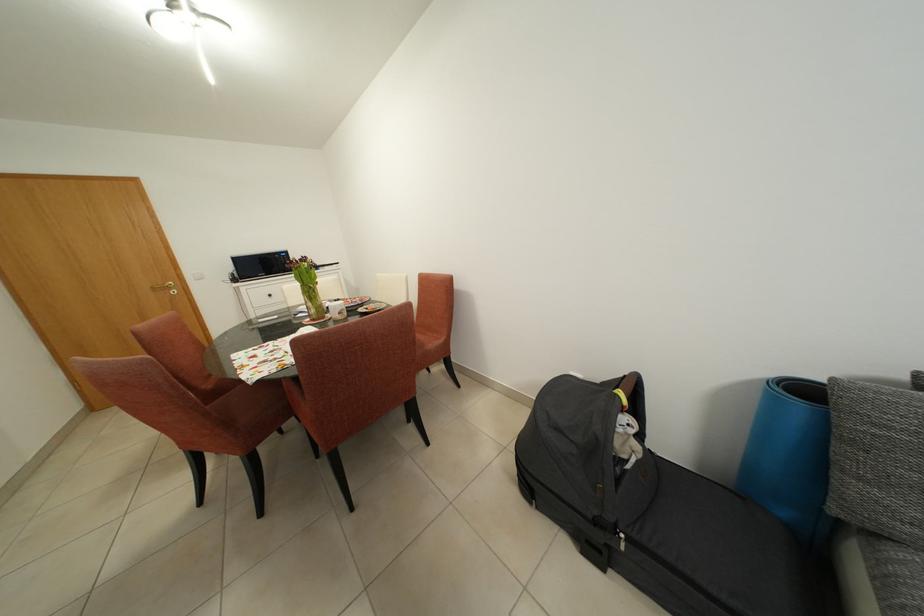
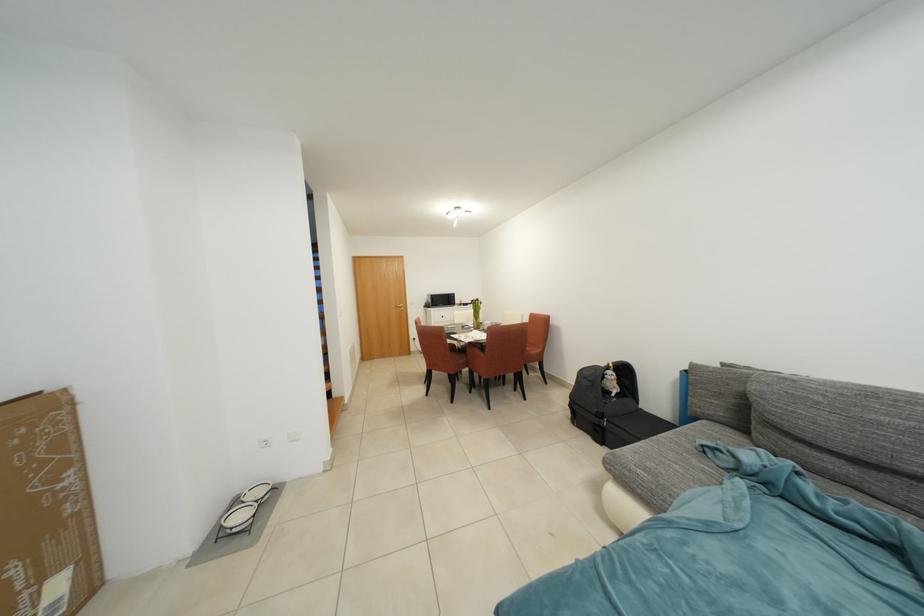
Question: In a continuous first-person perspective shot, in which direction is the camera moving?

Choices:
 (A) Left
 (B) Right
 (C) Forward
 (D) Backward

Answer: (D)